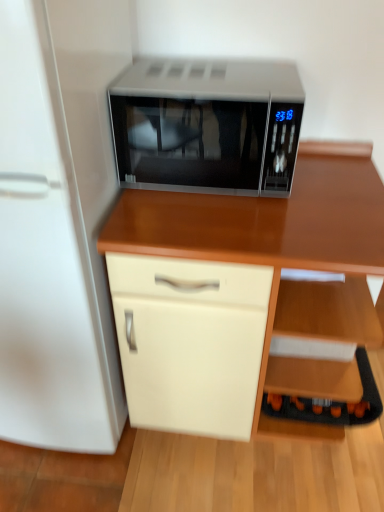
What is the approximate height of wooden desk at center?

The height of wooden desk at center is 90.66 centimeters.

Image resolution: width=384 pixels, height=512 pixels. Describe the element at coordinates (58, 223) in the screenshot. I see `white glossy refrigerator at left` at that location.

What do you see at coordinates (207, 126) in the screenshot?
I see `sleek silver microwave at center` at bounding box center [207, 126].

Find the location of a particular element. This screenshot has height=512, width=384. black plastic shelf at lower right is located at coordinates (328, 311).

Where is `wooden desk at center`? This screenshot has height=512, width=384. wooden desk at center is located at coordinates (242, 294).

Considering the positions of objects black plastic shelf at lower right and sleek silver microwave at center in the image provided, who is more to the left, black plastic shelf at lower right or sleek silver microwave at center?

From the viewer's perspective, sleek silver microwave at center appears more on the left side.

Is black plastic shelf at lower right further to the viewer compared to sleek silver microwave at center?

Yes, black plastic shelf at lower right is further from the viewer.

From the picture: Is black plastic shelf at lower right far from sleek silver microwave at center?

No.

Is black plastic shelf at lower right wider or thinner than sleek silver microwave at center?

black plastic shelf at lower right is thinner than sleek silver microwave at center.

Visually, is wooden desk at center positioned to the left or to the right of sleek silver microwave at center?

From the image, it's evident that wooden desk at center is to the right of sleek silver microwave at center.

Is wooden desk at center facing towards sleek silver microwave at center?

No.

Considering the sizes of objects wooden desk at center and sleek silver microwave at center in the image provided, who is thinner, wooden desk at center or sleek silver microwave at center?

With smaller width is sleek silver microwave at center.

At what (x,y) coordinates should I click in order to perform the action: click on desk located on the right of sleek silver microwave at center. Please return your answer as a coordinate pair (x, y). Looking at the image, I should click on (242, 294).

Between white glossy refrigerator at left and black plastic shelf at lower right, which one is positioned in front?

white glossy refrigerator at left is closer to the camera.

Which is further, (68, 85) or (337, 286)?

The point (337, 286) is behind.

From a real-world perspective, is white glossy refrigerator at left over black plastic shelf at lower right?

Yes, from a real-world perspective, white glossy refrigerator at left is over black plastic shelf at lower right

Considering the sizes of objects white glossy refrigerator at left and black plastic shelf at lower right in the image provided, who is thinner, white glossy refrigerator at left or black plastic shelf at lower right?

black plastic shelf at lower right.

Can white glossy refrigerator at left be found inside wooden desk at center?

That's incorrect, white glossy refrigerator at left is not inside wooden desk at center.

Between wooden desk at center and white glossy refrigerator at left, which one appears on the left side from the viewer's perspective?

white glossy refrigerator at left.

Who is smaller, wooden desk at center or white glossy refrigerator at left?

wooden desk at center.

From the image's perspective, is wooden desk at center located above white glossy refrigerator at left?

Actually, wooden desk at center appears below white glossy refrigerator at left in the image.

What's the angular difference between white glossy refrigerator at left and sleek silver microwave at center's facing directions?

1.53 degrees.

Considering the relative sizes of white glossy refrigerator at left and sleek silver microwave at center in the image provided, is white glossy refrigerator at left bigger than sleek silver microwave at center?

Correct, white glossy refrigerator at left is larger in size than sleek silver microwave at center.

Between white glossy refrigerator at left and sleek silver microwave at center, which one has larger width?

With larger width is white glossy refrigerator at left.

From a real-world perspective, is black plastic shelf at lower right physically located above or below wooden desk at center?

In terms of real-world spatial position, black plastic shelf at lower right is below wooden desk at center.

How distant is black plastic shelf at lower right from wooden desk at center?

black plastic shelf at lower right and wooden desk at center are 6.73 inches apart.

Is black plastic shelf at lower right at the left side of wooden desk at center?

No.

The image size is (384, 512). I want to click on microwave oven above the white glossy refrigerator at left (from the image's perspective), so click(x=207, y=126).

Could you tell me if sleek silver microwave at center is facing white glossy refrigerator at left?

No, sleek silver microwave at center is not turned towards white glossy refrigerator at left.

Considering the sizes of sleek silver microwave at center and white glossy refrigerator at left in the image, is sleek silver microwave at center taller or shorter than white glossy refrigerator at left?

Considering their sizes, sleek silver microwave at center has less height than white glossy refrigerator at left.

Is sleek silver microwave at center further to the viewer compared to white glossy refrigerator at left?

That is True.

The image size is (384, 512). I want to click on microwave oven that is above the black plastic shelf at lower right (from the image's perspective), so click(x=207, y=126).

Find the location of a particular element. microwave oven located behind the wooden desk at center is located at coordinates (207, 126).

Looking at the image, which one is located closer to wooden desk at center, sleek silver microwave at center or white glossy refrigerator at left?

The object closer to wooden desk at center is sleek silver microwave at center.

Considering their positions, is wooden desk at center positioned closer to sleek silver microwave at center than white glossy refrigerator at left?

wooden desk at center.

Considering their positions, is wooden desk at center positioned closer to white glossy refrigerator at left than sleek silver microwave at center?

sleek silver microwave at center.

Estimate the real-world distances between objects in this image. Which object is closer to wooden desk at center, black plastic shelf at lower right or white glossy refrigerator at left?

Based on the image, black plastic shelf at lower right appears to be nearer to wooden desk at center.

Looking at the image, which one is located further to black plastic shelf at lower right, wooden desk at center or sleek silver microwave at center?

sleek silver microwave at center is positioned further to the anchor black plastic shelf at lower right.

When comparing their distances from black plastic shelf at lower right, does white glossy refrigerator at left or sleek silver microwave at center seem further?

white glossy refrigerator at left.

Looking at the image, which one is located further to white glossy refrigerator at left, sleek silver microwave at center or wooden desk at center?

wooden desk at center is positioned further to the anchor white glossy refrigerator at left.

From the image, which object appears to be farther from sleek silver microwave at center, black plastic shelf at lower right or wooden desk at center?

Based on the image, black plastic shelf at lower right appears to be further to sleek silver microwave at center.

The height and width of the screenshot is (512, 384). Identify the location of microwave oven between white glossy refrigerator at left and wooden desk at center in the horizontal direction. [x=207, y=126].

At what (x,y) coordinates should I click in order to perform the action: click on desk between sleek silver microwave at center and black plastic shelf at lower right from top to bottom. Please return your answer as a coordinate pair (x, y). The width and height of the screenshot is (384, 512). Looking at the image, I should click on (242, 294).

Locate an element on the screen. microwave oven between white glossy refrigerator at left and black plastic shelf at lower right from left to right is located at coordinates (207, 126).

The width and height of the screenshot is (384, 512). In order to click on desk between white glossy refrigerator at left and black plastic shelf at lower right in this screenshot , I will do `click(242, 294)`.